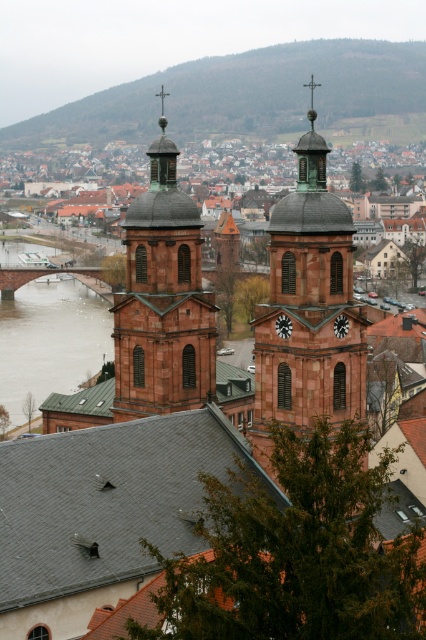
Between point (336, 417) and point (57, 387), which one is positioned in front?

Point (336, 417) is in front.

Is matte copper clock tower at center closer to the viewer compared to brown concrete bridge at lower left?

Yes, it is in front of brown concrete bridge at lower left.

Describe the element at coordinates (308, 308) in the screenshot. Image resolution: width=426 pixels, height=640 pixels. I see `matte copper clock tower at center` at that location.

Identify the location of matte copper clock tower at center. This screenshot has width=426, height=640. (308, 308).

Based on the photo, is reddish-brown stone clock tower at center below concrete stone bridge at left?

Correct, reddish-brown stone clock tower at center is located below concrete stone bridge at left.

Is reddish-brown stone clock tower at center behind concrete stone bridge at left?

No, it is in front of concrete stone bridge at left.

Is point (190, 369) less distant than point (0, 276)?

Yes, point (190, 369) is in front of point (0, 276).

I want to click on reddish-brown stone clock tower at center, so click(163, 300).

Based on the photo, can you confirm if matte copper clock tower at center is positioned to the left of concrete stone bridge at left?

Incorrect, matte copper clock tower at center is not on the left side of concrete stone bridge at left.

Can you confirm if matte copper clock tower at center is wider than concrete stone bridge at left?

Incorrect, matte copper clock tower at center's width does not surpass concrete stone bridge at left's.

Between point (351, 282) and point (104, 280), which one is positioned behind?

Point (104, 280)

Locate an element on the screen. Image resolution: width=426 pixels, height=640 pixels. matte copper clock tower at center is located at coordinates (308, 308).